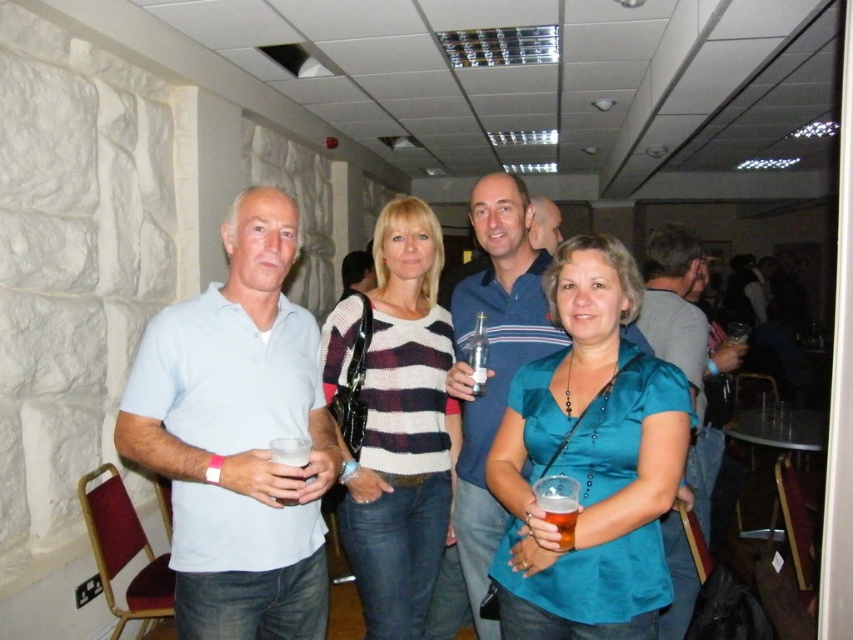
Question: Does teal satin blouse at center appear over matte blue shirt at center?

Choices:
 (A) no
 (B) yes

Answer: (B)

Question: Which object is closer to the camera taking this photo?

Choices:
 (A) striped knit sweater at center
 (B) light blue polo shirt at left
 (C) matte blue shirt at center
 (D) translucent plastic cup at center

Answer: (D)

Question: Which point is closer to the camera?

Choices:
 (A) light blue polo shirt at left
 (B) clear glass bottle at center
 (C) smooth skin head at upper center

Answer: (A)

Question: Observing the image, what is the correct spatial positioning of light blue polo shirt at left in reference to clear plastic cup at center?

Choices:
 (A) right
 (B) left

Answer: (B)

Question: Based on their relative distances, which object is farther from the clear glass bottle at center?

Choices:
 (A) matte blue shirt at center
 (B) clear plastic cup at center

Answer: (A)

Question: Can you confirm if striped knit sweater at center is positioned to the right of smooth skin head at upper center?

Choices:
 (A) yes
 (B) no

Answer: (B)